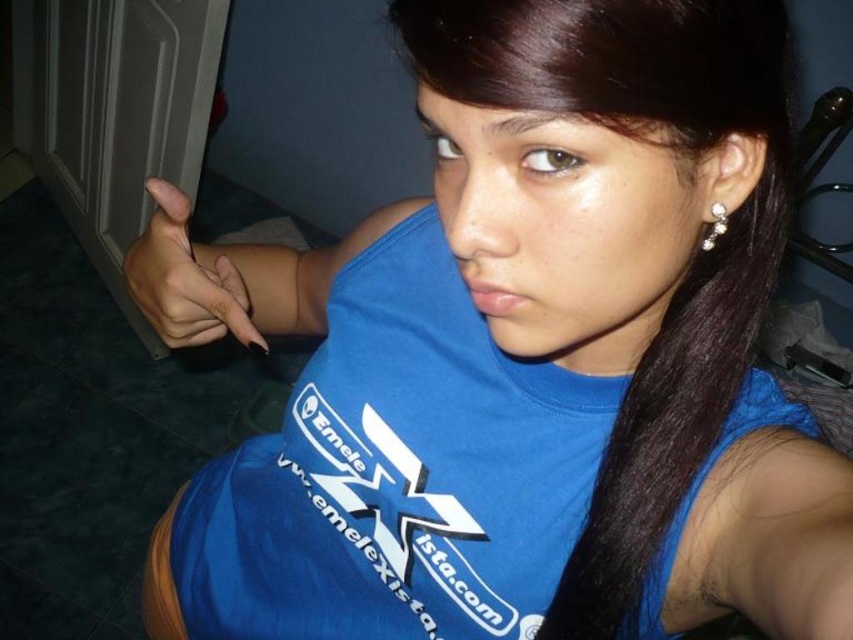
You are trying to decide whether to place a small decorative item on the table between the nail polish at center and the pearl shiny earrings at upper right. The item is 3 centimeters wide. Can you fit it there?

The nail polish at center might be wider than pearl shiny earrings at upper right, so the space between them may not be sufficient for a 3 cm wide item. Check the exact measurements before placing it.

You are designing a layout for a product catalog and need to place the nail polish at center and pearl shiny earrings at upper right. Given their sizes, which item should be placed closer to the viewer to maintain visual balance?

The nail polish at center should be placed closer to the viewer because it is larger than the pearl shiny earrings at upper right, helping to balance their sizes in the layout.

You are an interior designer trying to plan the layout of a room. You notice the pearl shiny earrings at upper right and the nail polish at center in the image. Based on their positions, which object is closer to the viewer?

The nail polish at center is closer to the viewer because the pearl shiny earrings at upper right is behind it.